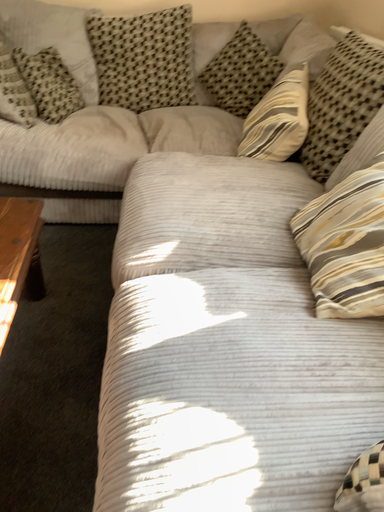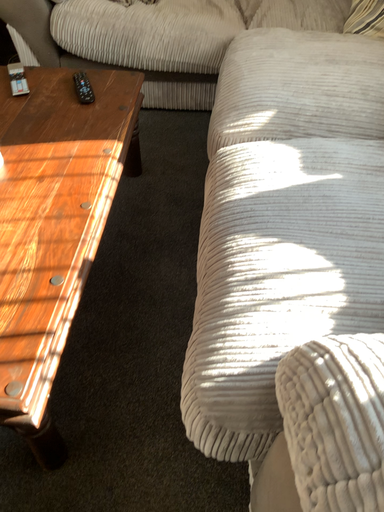
Question: Which way did the camera rotate in the video?

Choices:
 (A) rotated downward
 (B) rotated upward

Answer: (A)